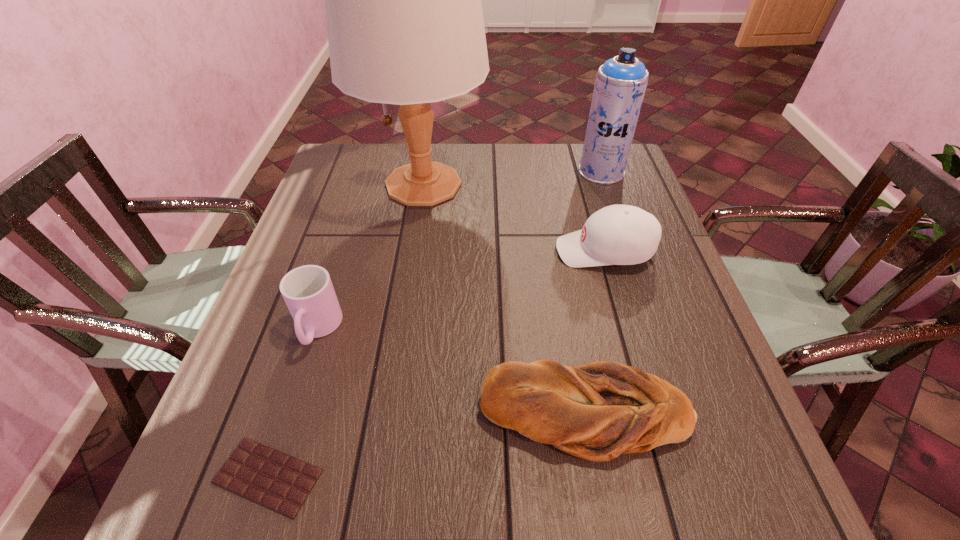
Where is `vacant area between the fifth tallest object and the shortest object`? vacant area between the fifth tallest object and the shortest object is located at coordinates (427, 445).

Locate an element on the screen. The height and width of the screenshot is (540, 960). vacant space in between the fifth shortest object and the third nearest object is located at coordinates (460, 251).

You are a GUI agent. You are given a task and a screenshot of the screen. Output one action in this format:
    pyautogui.click(x=<x>, y=<y>)
    Task: Click on the object that is the fourth closest one to the fourth farthest object
    This screenshot has width=960, height=540.
    Given the screenshot: What is the action you would take?
    pyautogui.click(x=617, y=234)

Identify which object is the third nearest to the tallest object. Please provide its 2D coordinates. Your answer should be formatted as a tuple, i.e. [(x, y)], where the tuple contains the x and y coordinates of a point satisfying the conditions above.

[(620, 84)]

This screenshot has height=540, width=960. In order to click on blank space that satisfies the following two spatial constraints: 1. on the front-facing side of the third farthest object; 2. with the handle on the side of the cup in this screenshot , I will do pyautogui.click(x=627, y=329).

The image size is (960, 540). Find the location of `vacant space that satisfies the following two spatial constraints: 1. on the back side of the aerosol can; 2. on the left side of the second shortest object`. vacant space that satisfies the following two spatial constraints: 1. on the back side of the aerosol can; 2. on the left side of the second shortest object is located at coordinates (543, 172).

Image resolution: width=960 pixels, height=540 pixels. Identify the location of vacant space that satisfies the following two spatial constraints: 1. on the front-facing side of the fourth nearest object; 2. on the front side of the shortest object. pyautogui.click(x=669, y=476).

Locate an element on the screen. The height and width of the screenshot is (540, 960). vacant space that satisfies the following two spatial constraints: 1. on the front-facing side of the fourth nearest object; 2. with the handle on the side of the cup is located at coordinates (627, 329).